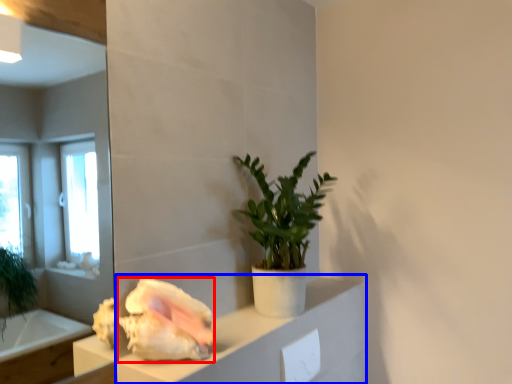
Question: Which point is closer to the camera, flower (highlighted by a red box) or cabinetry (highlighted by a blue box)?

Choices:
 (A) flower
 (B) cabinetry

Answer: (B)